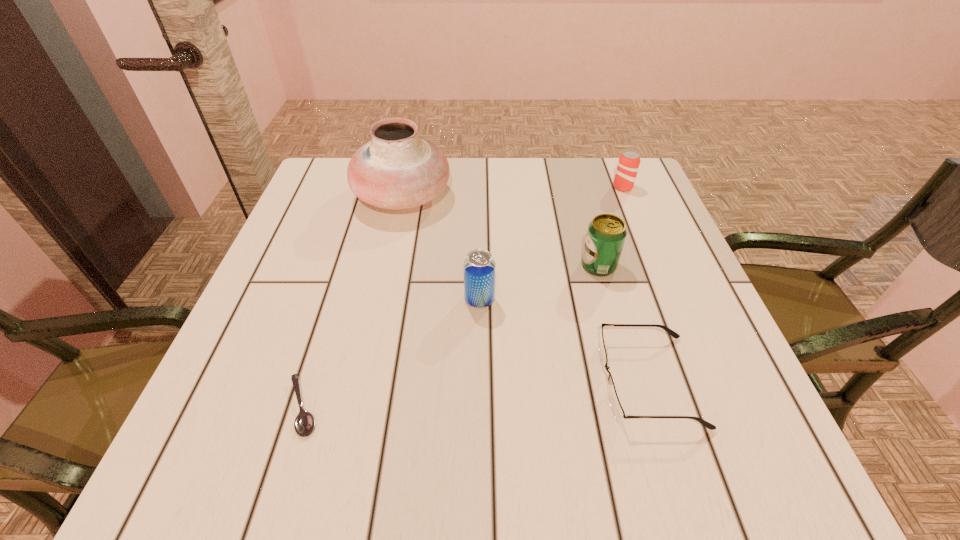
I want to click on soupspoon present at the near edge, so click(304, 424).

The width and height of the screenshot is (960, 540). I want to click on pottery present at the left edge, so coord(397,169).

The image size is (960, 540). Identify the location of soupspoon located in the left edge section of the desktop. (304, 424).

Find the location of `spectacles that is at the right edge`. spectacles that is at the right edge is located at coordinates (619, 414).

This screenshot has height=540, width=960. What are the coordinates of `object that is at the far left corner` in the screenshot? It's located at (397, 169).

At what (x,y) coordinates should I click in order to perform the action: click on object present at the near left corner. Please return your answer as a coordinate pair (x, y). Image resolution: width=960 pixels, height=540 pixels. Looking at the image, I should click on (304, 424).

The height and width of the screenshot is (540, 960). What are the coordinates of `object located at the far right corner` in the screenshot? It's located at (628, 164).

At what (x,y) coordinates should I click in order to perform the action: click on object located at the near right corner. Please return your answer as a coordinate pair (x, y). The height and width of the screenshot is (540, 960). Looking at the image, I should click on (619, 414).

The width and height of the screenshot is (960, 540). In the image, there is a desktop. Find the location of `vacant region at the far edge`. vacant region at the far edge is located at coordinates (452, 167).

Identify the location of vacant space at the near edge of the desktop. (335, 426).